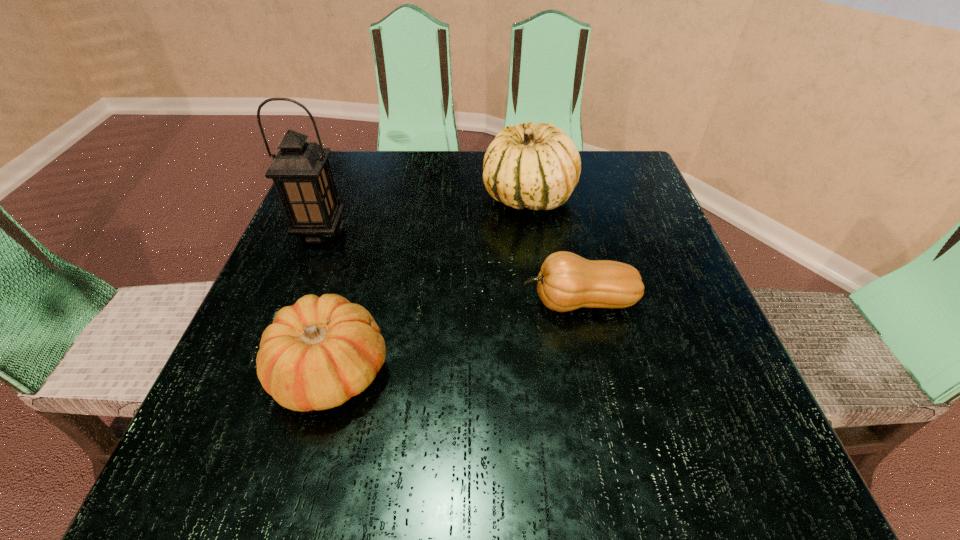
You are a GUI agent. You are given a task and a screenshot of the screen. Output one action in this format:
    pyautogui.click(x=<x>, y=<y>)
    Task: Click on the vacant area at the far left corner of the desktop
    The width and height of the screenshot is (960, 540).
    Given the screenshot: What is the action you would take?
    pyautogui.click(x=368, y=174)

Where is `blank space at the far right corner of the desktop`? The width and height of the screenshot is (960, 540). blank space at the far right corner of the desktop is located at coordinates (588, 190).

The image size is (960, 540). Identify the location of vacant area that lies between the nearest object and the second nearest object. (456, 337).

Identify the location of free space between the tallest gourd and the second nearest object. This screenshot has width=960, height=540. (554, 249).

Locate an element on the screen. The image size is (960, 540). empty space between the tallest object and the third farthest object is located at coordinates (450, 267).

Identify the location of vacant area that lies between the leftmost gourd and the second farthest gourd. This screenshot has height=540, width=960. (456, 337).

You are a GUI agent. You are given a task and a screenshot of the screen. Output one action in this format:
    pyautogui.click(x=<x>, y=<y>)
    Task: Click on the vacant area that lies between the second nearest gourd and the leftmost gourd
    
    Given the screenshot: What is the action you would take?
    pyautogui.click(x=456, y=337)

Locate an element on the screen. The image size is (960, 540). blank region between the nearest object and the second farthest gourd is located at coordinates (456, 337).

I want to click on free spot between the lantern and the tallest gourd, so click(425, 214).

At what (x,y) coordinates should I click in order to perform the action: click on unoccupied position between the farthest gourd and the lantern. Please return your answer as a coordinate pair (x, y). The height and width of the screenshot is (540, 960). Looking at the image, I should click on (425, 214).